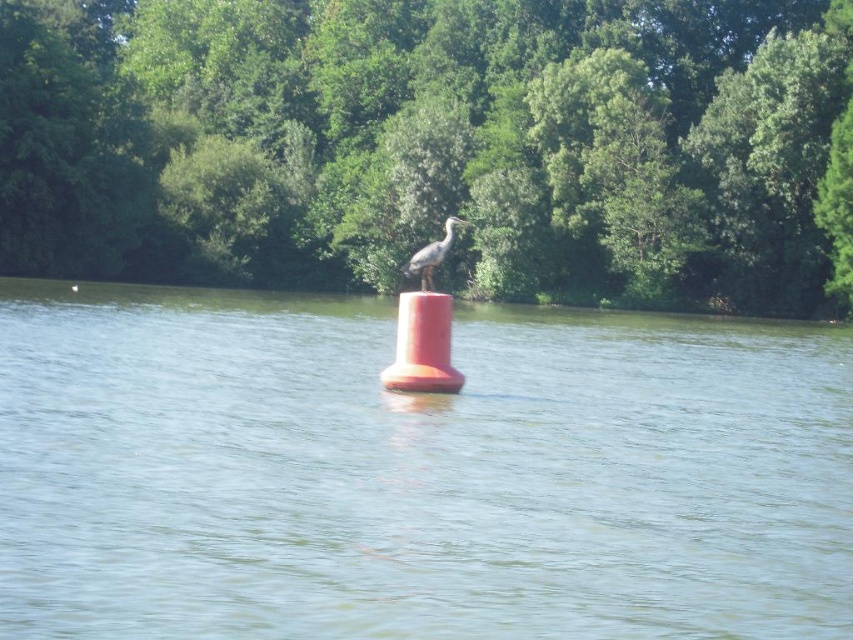
Question: Observing the image, what is the correct spatial positioning of green leafy trees at center in reference to gray feathered bird at center?

Choices:
 (A) above
 (B) below

Answer: (A)

Question: Considering the real-world distances, which object is closest to the gray feathered bird at center?

Choices:
 (A) orange buoy at center
 (B) orange matte buoy at center
 (C) green leafy trees at center

Answer: (B)

Question: Where is orange buoy at center located in relation to orange matte buoy at center in the image?

Choices:
 (A) right
 (B) left

Answer: (B)

Question: Among these points, which one is farthest from the camera?

Choices:
 (A) (405, 564)
 (B) (433, 353)
 (C) (119, 124)
 (D) (430, 248)

Answer: (C)

Question: Which of the following is the closest to the observer?

Choices:
 (A) orange buoy at center
 (B) gray feathered bird at center

Answer: (A)

Question: Does orange matte buoy at center have a larger size compared to gray feathered bird at center?

Choices:
 (A) yes
 (B) no

Answer: (B)